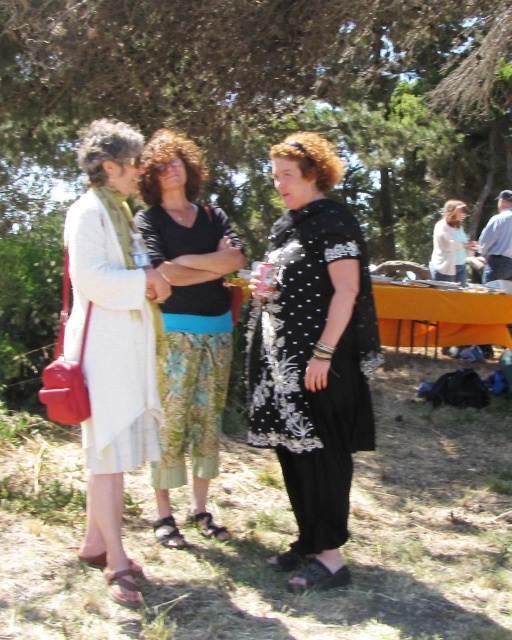
Can you confirm if matte white dress at left is wider than white lace dress at center?

In fact, matte white dress at left might be narrower than white lace dress at center.

At what (x,y) coordinates should I click in order to perform the action: click on matte white dress at left. Please return your answer as a coordinate pair (x, y). Looking at the image, I should click on (113, 340).

Find the location of a particular element. matte white dress at left is located at coordinates (113, 340).

Which is in front, point (468, 58) or point (450, 200)?

Point (468, 58)

Can you confirm if green leafy tree at upper center is positioned above white lace dress at center?

Yes.

Who is more forward, [301,29] or [459,212]?

Positioned in front is point [301,29].

In order to click on green leafy tree at upper center in this screenshot , I will do `click(256, 112)`.

Does green leafy tree at upper center appear on the right side of black embroidered dress at center?

Yes, green leafy tree at upper center is to the right of black embroidered dress at center.

Where is `green leafy tree at upper center`? green leafy tree at upper center is located at coordinates (256, 112).